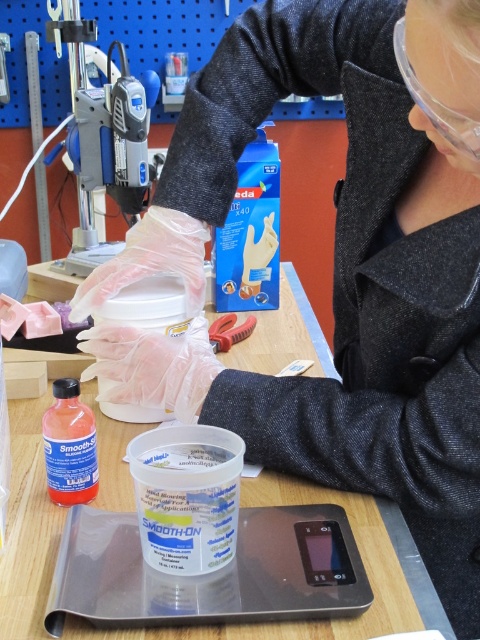
You are a safety inspector checking the workspace. You notice the translucent orange liquid at center and the rubberized plastic pliers at center. Which object is located below the other?

The translucent orange liquid at center is positioned under the rubberized plastic pliers at center.

You are a safety inspector checking the workspace. You notice the translucent orange liquid at center and the clear plastic goggles at upper right. Which object takes up more horizontal space in the image?

The translucent orange liquid at center takes up more horizontal space than the clear plastic goggles at upper right because its width is larger.

You are a safety inspector checking the workspace. The clear plastic goggles at upper right are essential for eye protection. Is the translucent orange liquid at center in a safe position relative to the goggles?

The translucent orange liquid at center is positioned under the clear plastic goggles at upper right, which means if the liquid spills, it could potentially reach the goggles, making the setup unsafe. The goggles should be placed higher or the liquid container moved to a different location to prevent contamination or damage.